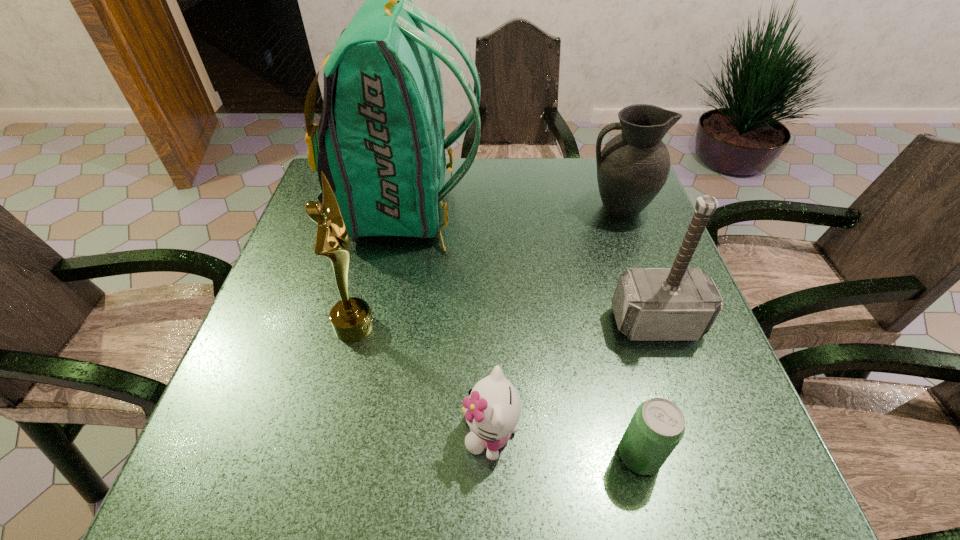
The height and width of the screenshot is (540, 960). Identify the location of vacant point located between the soda and the tallest object. (521, 332).

I want to click on free space between the tallest object and the hammer, so click(530, 266).

Select which object is the fifth closest to the kitten. Please provide its 2D coordinates. Your answer should be formatted as a tuple, i.e. [(x, y)], where the tuple contains the x and y coordinates of a point satisfying the conditions above.

[(632, 168)]

Locate which object ranks third in proximity to the backpack. Please provide its 2D coordinates. Your answer should be formatted as a tuple, i.e. [(x, y)], where the tuple contains the x and y coordinates of a point satisfying the conditions above.

[(650, 304)]

Where is `free spot that satisfies the following two spatial constraints: 1. for striking with the head of the hammer; 2. on the front-facing side of the award`? free spot that satisfies the following two spatial constraints: 1. for striking with the head of the hammer; 2. on the front-facing side of the award is located at coordinates (657, 326).

At what (x,y) coordinates should I click in order to perform the action: click on vacant region that satisfies the following two spatial constraints: 1. on the back of the tallest object; 2. on the left side of the soda. Please return your answer as a coordinate pair (x, y). The width and height of the screenshot is (960, 540). Looking at the image, I should click on (354, 455).